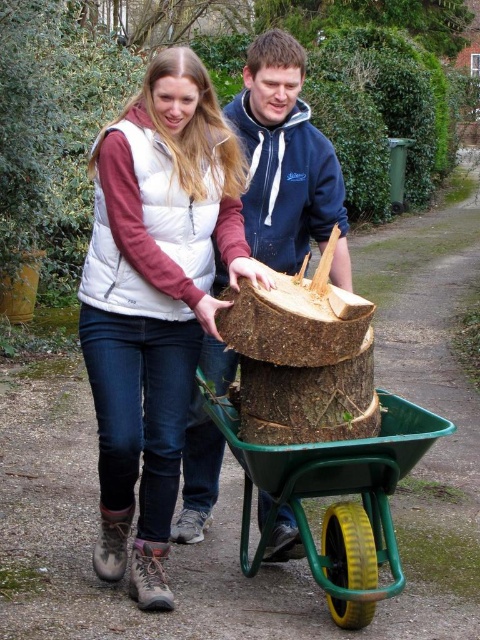
You are a delivery person who needs to place a blue fleece jacket at center and a green plastic cart at center on a shelf. The shelf has a height limit of 1 meter. Can both items be placed on the shelf without exceeding the height limit?

The blue fleece jacket at center is taller than the green plastic cart at center. If the jacket exceeds 1 meter in height, it would not fit on the shelf. However, if the jacket is under 1 meter, both can be placed.

You are standing at the camera position and want to place a flag at the closest point between point [157,346] and point [257,204]. Which point should you choose?

Point [157,346] is closer to the camera than point [257,204], so you should place the flag at point [157,346].

You are a delivery person who needs to carry a 10kg package. You see the white fleece vest at upper left and the green plastic cart at center. Which object can better support the package?

The green plastic cart at center can better support the package because it is thicker than the white fleece vest at upper left.